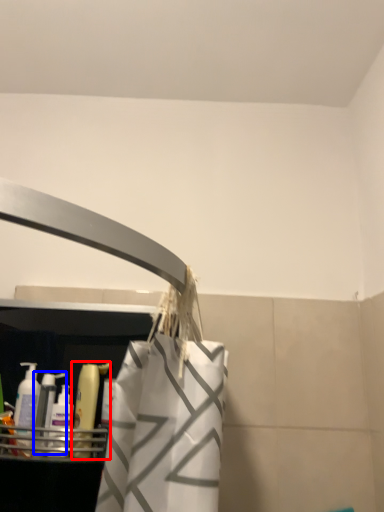
Question: Which object appears closest to the camera in this image, cleaning product (highlighted by a red box) or cleaning product (highlighted by a blue box)?

Choices:
 (A) cleaning product
 (B) cleaning product

Answer: (B)